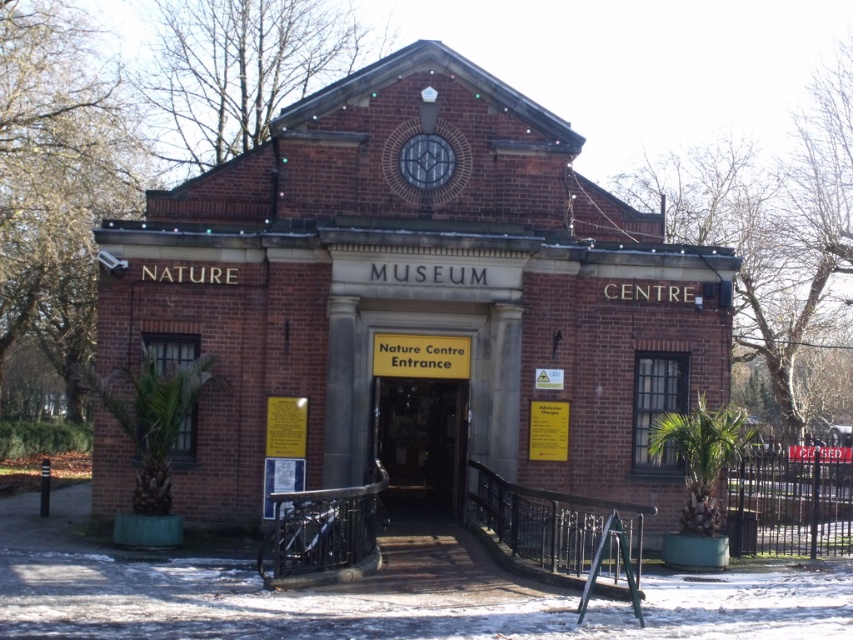
You are standing in front of the brick building at center and want to enter through the wooden door at center. Considering the building and door sizes, will the door be wide enough for a standard wheelchair to pass through? Please explain your reasoning.

The brick building at center is wider than the wooden door at center. Since the door is narrower than the building, it may not be wide enough for a standard wheelchair. However, without specific measurements, we can only infer based on relative sizes. If the door is significantly narrower than the building, it might pose accessibility issues.

You are standing at the point marked as point (416, 292). Which building are you facing?

The point (416, 292) marks the brick building at center, so you are facing the brick building labeled NATURE MUSEUM CENTRE at its top facade.